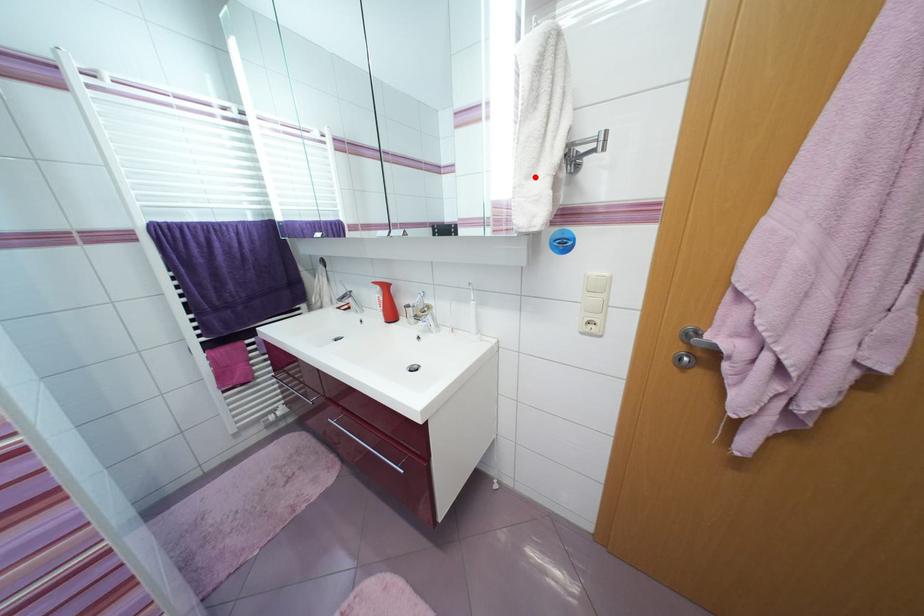
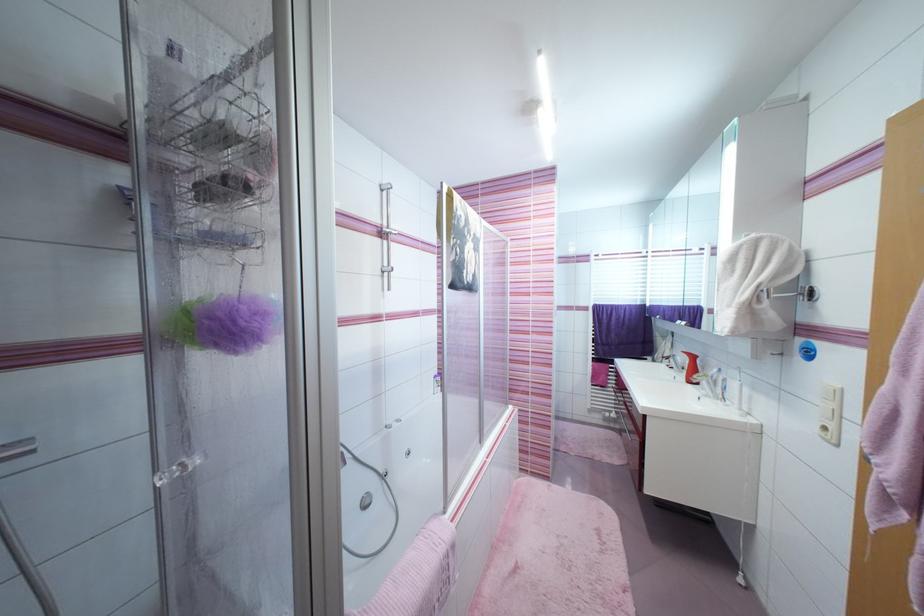
The point at the highlighted location is marked in the first image. Where is the corresponding point in the second image?

(735, 307)